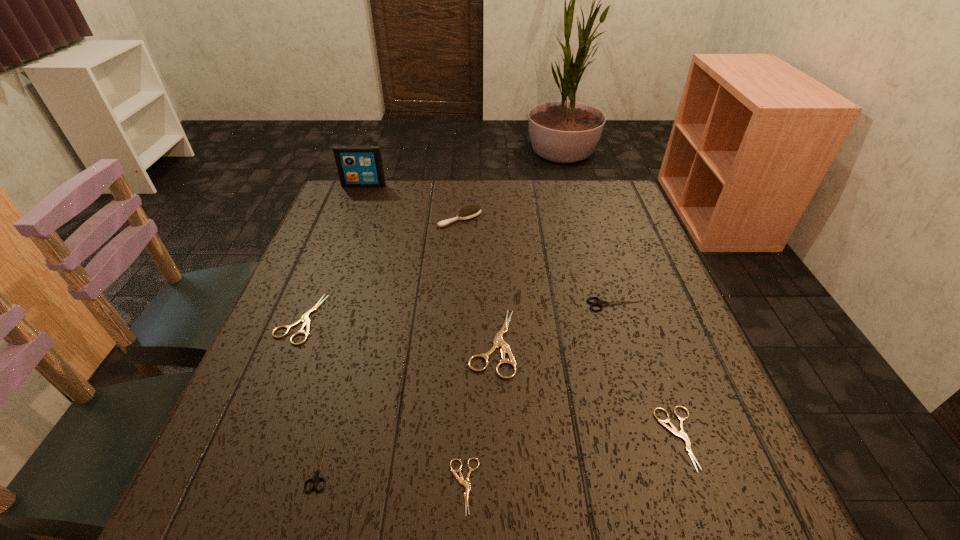
Identify the location of the nearer black shears. (316, 478).

Where is `the sixth object from right to left`? This screenshot has width=960, height=540. the sixth object from right to left is located at coordinates (316, 478).

Locate an element on the screen. This screenshot has height=540, width=960. the smallest beige shears is located at coordinates (465, 483).

The image size is (960, 540). Identify the location of the shortest shears. (465, 483).

In order to click on vacant space located on the front screen of the farthest object in this screenshot , I will do `click(349, 223)`.

Find the location of a particular element. free spot located on the right of the seventh nearest object is located at coordinates (545, 219).

Locate an element on the screen. The image size is (960, 540). vacant region located on the left of the biggest beige shears is located at coordinates point(444,343).

The width and height of the screenshot is (960, 540). Identify the location of vacant space positioned on the front of the farther black shears. pos(654,428).

Image resolution: width=960 pixels, height=540 pixels. In order to click on vacant space located 0.180m on the back of the leftmost shears in this screenshot , I will do `click(330, 247)`.

What are the coordinates of `free region located on the back of the second smallest beige shears` in the screenshot? It's located at (633, 308).